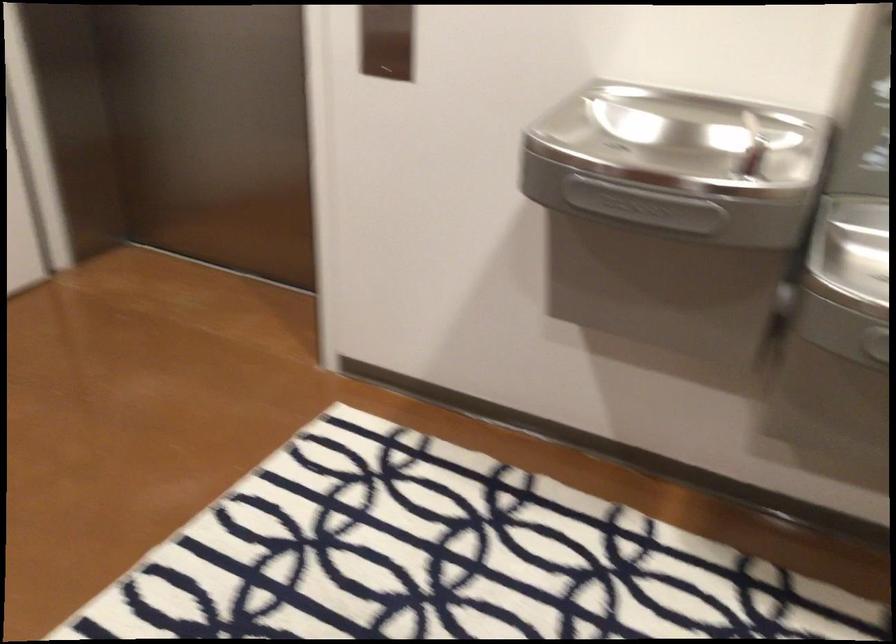
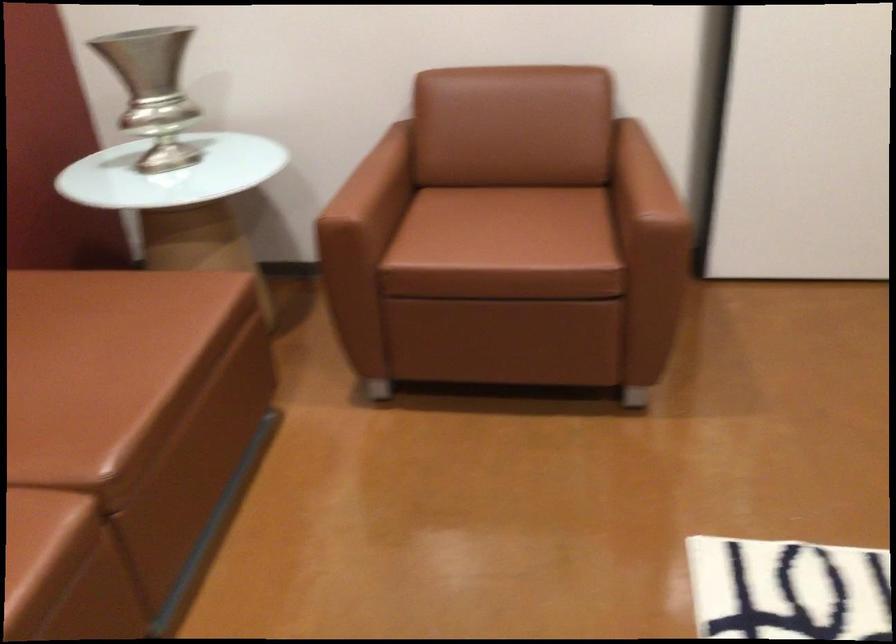
The first image is from the beginning of the video and the second image is from the end. How did the camera likely rotate when shooting the video?

The rotation direction of the camera is left-down.